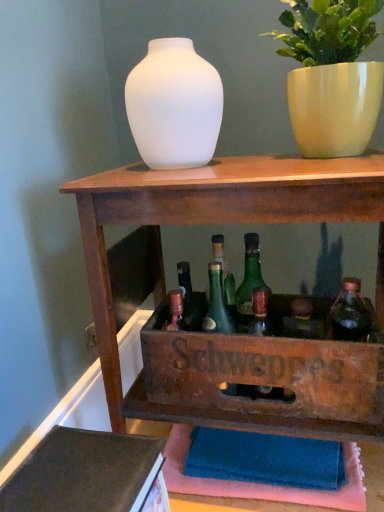
Question: In terms of width, does green glass bottle at center look wider or thinner when compared to white glossy pot at upper right?

Choices:
 (A) wide
 (B) thin

Answer: (B)

Question: Is green glass bottle at center inside or outside of white glossy pot at upper right?

Choices:
 (A) inside
 (B) outside

Answer: (B)

Question: Which object is the closest to the translucent glass bottle at center-right, which is the first bottle from right to left?

Choices:
 (A) wooden shelf at center
 (B) frosted glass vase at center
 (C) green glass bottle at center, the first bottle in the left-to-right sequence
 (D) white glossy pot at upper right
 (E) green glass bottle at center

Answer: (C)

Question: Which of these objects is positioned farthest from the wooden shelf at center?

Choices:
 (A) white glossy pot at upper right
 (B) translucent glass bottle at center-right, the second bottle viewed from the left
 (C) frosted glass vase at center
 (D) green glass bottle at center, the 2th bottle positioned from the right
 (E) green glass bottle at center

Answer: (B)